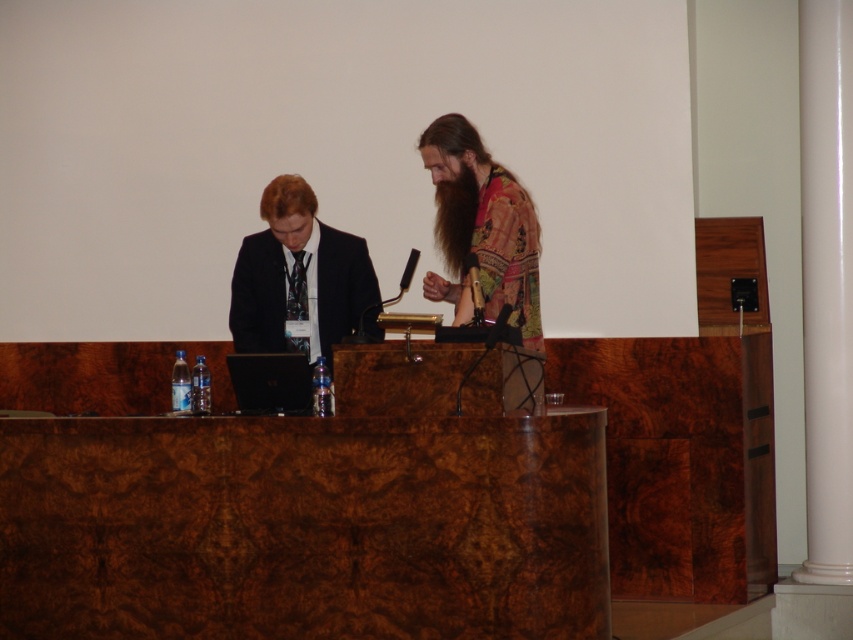
Describe the element at coordinates (305, 525) in the screenshot. The width and height of the screenshot is (853, 640). I see `brown wood table at center` at that location.

The width and height of the screenshot is (853, 640). In order to click on brown wood table at center in this screenshot , I will do `click(305, 525)`.